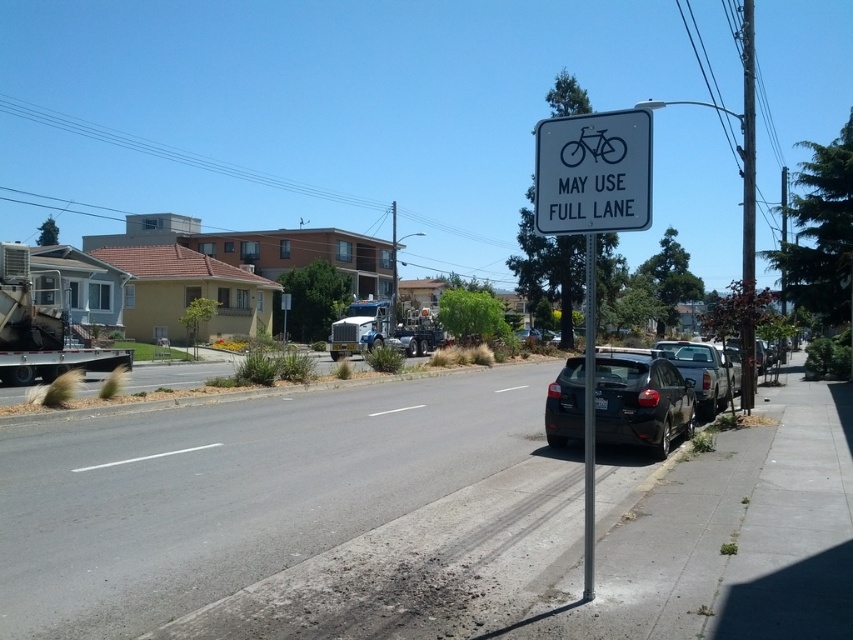
From the picture: You are a cyclist planning to ride along the road and see the sign at point (747, 152). What object is located at that point?

The metallic gray pole at right is located at point (747, 152).

You are a pedestrian standing on the sidewalk and want to look at the white plastic sign at upper center. Which direction should you look relative to the black metal pole at center?

The white plastic sign at upper center is above the black metal pole at center, so you should look upward towards the black metal pole at center to see the white plastic sign at upper center.